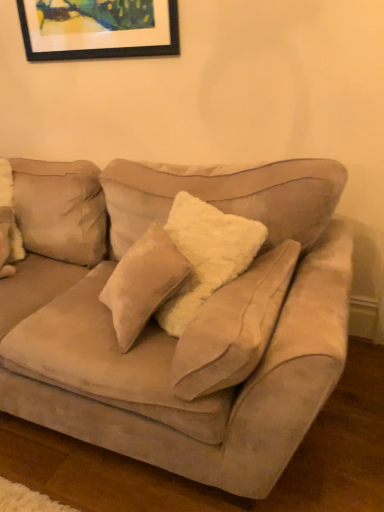
Question: From a real-world perspective, does matte black picture frame at upper center sit lower than suede couch at center?

Choices:
 (A) no
 (B) yes

Answer: (A)

Question: Is suede couch at center at the back of matte black picture frame at upper center?

Choices:
 (A) yes
 (B) no

Answer: (B)

Question: Can you confirm if matte black picture frame at upper center is wider than suede couch at center?

Choices:
 (A) no
 (B) yes

Answer: (A)

Question: Is suede couch at center completely or partially inside matte black picture frame at upper center?

Choices:
 (A) yes
 (B) no

Answer: (B)

Question: Considering the relative positions of matte black picture frame at upper center and suede couch at center in the image provided, is matte black picture frame at upper center behind suede couch at center?

Choices:
 (A) no
 (B) yes

Answer: (B)

Question: Does matte black picture frame at upper center have a greater height compared to suede couch at center?

Choices:
 (A) no
 (B) yes

Answer: (A)

Question: Considering the relative sizes of suede couch at center and matte black picture frame at upper center in the image provided, is suede couch at center wider than matte black picture frame at upper center?

Choices:
 (A) yes
 (B) no

Answer: (A)

Question: Is matte black picture frame at upper center completely or partially inside suede couch at center?

Choices:
 (A) no
 (B) yes

Answer: (A)

Question: Is suede couch at center next to matte black picture frame at upper center and touching it?

Choices:
 (A) yes
 (B) no

Answer: (B)

Question: Does suede couch at center appear on the left side of matte black picture frame at upper center?

Choices:
 (A) no
 (B) yes

Answer: (B)

Question: Can you confirm if suede couch at center is taller than matte black picture frame at upper center?

Choices:
 (A) yes
 (B) no

Answer: (A)

Question: Considering the relative sizes of suede couch at center and matte black picture frame at upper center in the image provided, is suede couch at center smaller than matte black picture frame at upper center?

Choices:
 (A) no
 (B) yes

Answer: (A)

Question: Is matte black picture frame at upper center taller or shorter than suede couch at center?

Choices:
 (A) tall
 (B) short

Answer: (B)